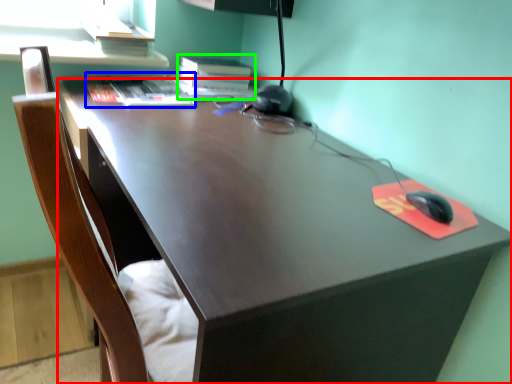
Question: Considering the real-world distances, which object is farthest from desk (highlighted by a red box)? book (highlighted by a blue box) or book (highlighted by a green box)?

Choices:
 (A) book
 (B) book

Answer: (B)